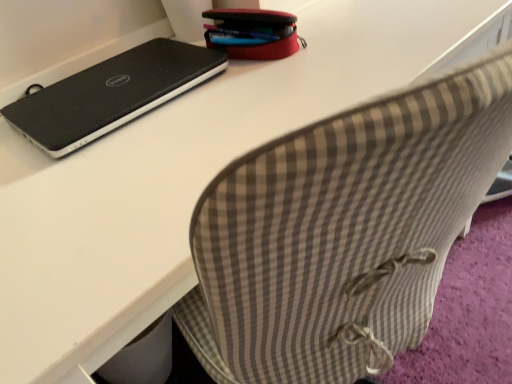
Question: From a real-world perspective, relative to red fabric pencil case at upper center, is black matte laptop at upper left vertically above or below?

Choices:
 (A) below
 (B) above

Answer: (A)

Question: From the image's perspective, relative to red fabric pencil case at upper center, is black matte laptop at upper left above or below?

Choices:
 (A) below
 (B) above

Answer: (A)

Question: In terms of height, does black matte laptop at upper left look taller or shorter compared to red fabric pencil case at upper center?

Choices:
 (A) short
 (B) tall

Answer: (A)

Question: Is red fabric pencil case at upper center in front of or behind black matte laptop at upper left in the image?

Choices:
 (A) front
 (B) behind

Answer: (B)

Question: Is point (256, 46) positioned closer to the camera than point (202, 72)?

Choices:
 (A) closer
 (B) farther

Answer: (B)

Question: From the image's perspective, is red fabric pencil case at upper center above or below black matte laptop at upper left?

Choices:
 (A) above
 (B) below

Answer: (A)

Question: Considering the positions of red fabric pencil case at upper center and black matte laptop at upper left in the image, is red fabric pencil case at upper center bigger or smaller than black matte laptop at upper left?

Choices:
 (A) big
 (B) small

Answer: (B)